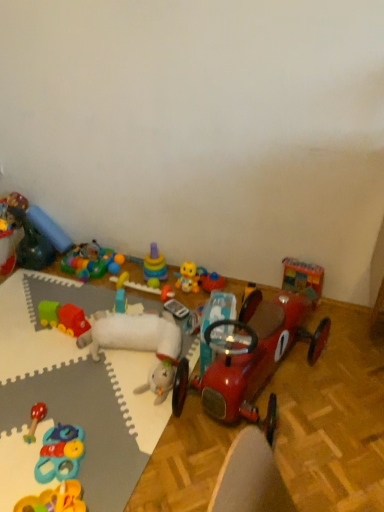
In order to face white plush lamb at lower left, acting as the eighth toy starting from the left, should I rotate leftwards or rightwards?

It's best to rotate left around 7.818 degrees.

Locate an element on the screen. This screenshot has height=512, width=384. white plush lamb at lower left, the fifth toy positioned from the right is located at coordinates (133, 334).

What are the coordinates of `rubber green and red train at lower left, marked as the 4th toy in a left-to-right arrangement` in the screenshot? It's located at (63, 318).

In order to face wooden toy car at upper right, the twelfth toy when ordered from left to right, should I rotate leftwards or rightwards?

Rotate your view right by about 14.452°.

Image resolution: width=384 pixels, height=512 pixels. Find the location of `translucent plastic toy at center, arranged as the 5th toy when viewed from the left`. translucent plastic toy at center, arranged as the 5th toy when viewed from the left is located at coordinates (87, 261).

Is rubberized plastic toy at lower left, placed as the 7th toy when sorted from left to right, smaller than wooden toy car at upper right, the first toy viewed from the right?

Yes, rubberized plastic toy at lower left, placed as the 7th toy when sorted from left to right, is smaller than wooden toy car at upper right, the first toy viewed from the right.

How different are the orientations of rubberized plastic toy at lower left, marked as the sixth toy in a right-to-left arrangement, and wooden toy car at upper right, the twelfth toy when ordered from left to right, in degrees?

There is a 55-degree angle between the facing directions of rubberized plastic toy at lower left, marked as the sixth toy in a right-to-left arrangement, and wooden toy car at upper right, the twelfth toy when ordered from left to right.

Is there a large distance between rubberized plastic toy at lower left, marked as the sixth toy in a right-to-left arrangement, and wooden toy car at upper right, the twelfth toy when ordered from left to right?

Yes, rubberized plastic toy at lower left, marked as the sixth toy in a right-to-left arrangement, and wooden toy car at upper right, the twelfth toy when ordered from left to right, are quite far apart.

Could you tell me if rubberized plastic toy at lower left, marked as the sixth toy in a right-to-left arrangement, is turned towards wooden toy car at upper right, the twelfth toy when ordered from left to right?

No, rubberized plastic toy at lower left, marked as the sixth toy in a right-to-left arrangement, is not turned towards wooden toy car at upper right, the twelfth toy when ordered from left to right.

Which is more to the right, wooden rattle at lower left, the seventh toy viewed from the right, or rubber green and red train at lower left, positioned as the ninth toy in right-to-left order?

wooden rattle at lower left, the seventh toy viewed from the right, is more to the right.

Considering the relative sizes of wooden rattle at lower left, positioned as the 6th toy in left-to-right order, and rubber green and red train at lower left, positioned as the ninth toy in right-to-left order, in the image provided, is wooden rattle at lower left, positioned as the 6th toy in left-to-right order, taller than rubber green and red train at lower left, positioned as the ninth toy in right-to-left order,?

In fact, wooden rattle at lower left, positioned as the 6th toy in left-to-right order, may be shorter than rubber green and red train at lower left, positioned as the ninth toy in right-to-left order.

From a real-world perspective, between wooden rattle at lower left, the seventh toy viewed from the right, and rubber green and red train at lower left, positioned as the ninth toy in right-to-left order, who is vertically lower?

wooden rattle at lower left, the seventh toy viewed from the right, is physically lower.

Would you say wooden rattle at lower left, positioned as the 6th toy in left-to-right order, is a long distance from rubber green and red train at lower left, marked as the 4th toy in a left-to-right arrangement?

No, wooden rattle at lower left, positioned as the 6th toy in left-to-right order, is not far away from rubber green and red train at lower left, marked as the 4th toy in a left-to-right arrangement.

From a real-world perspective, is shiny red car at center, acting as the 2th toy starting from the right, over blue fabric pillow at upper left, positioned as the 3th toy in left-to-right order?

Correct, in the physical world, shiny red car at center, acting as the 2th toy starting from the right, is higher than blue fabric pillow at upper left, positioned as the 3th toy in left-to-right order.

From the image's perspective, which object appears higher, shiny red car at center, acting as the 2th toy starting from the right, or blue fabric pillow at upper left, the tenth toy positioned from the right?

blue fabric pillow at upper left, the tenth toy positioned from the right, from the image's perspective.

Between shiny red car at center, acting as the 2th toy starting from the right, and blue fabric pillow at upper left, positioned as the 3th toy in left-to-right order, which one appears on the right side from the viewer's perspective?

Positioned to the right is shiny red car at center, acting as the 2th toy starting from the right.

Which is behind, shiny red car at center, acting as the 2th toy starting from the right, or blue fabric pillow at upper left, the tenth toy positioned from the right?

blue fabric pillow at upper left, the tenth toy positioned from the right.

In terms of size, does white foam mat at lower left appear bigger or smaller than wooden toy car at upper right, the first toy viewed from the right?

white foam mat at lower left is bigger than wooden toy car at upper right, the first toy viewed from the right.

Is white foam mat at lower left to the left of wooden toy car at upper right, the twelfth toy when ordered from left to right, from the viewer's perspective?

Indeed, white foam mat at lower left is positioned on the left side of wooden toy car at upper right, the twelfth toy when ordered from left to right.

From the image's perspective, is white foam mat at lower left on wooden toy car at upper right, the first toy viewed from the right?

No.

Considering the points (102, 298) and (287, 287), which point is behind, point (102, 298) or point (287, 287)?

Positioned behind is point (102, 298).

I want to click on the 4th toy located beneath the rubber duck at left, the twelfth toy from the right (from a real-world perspective), so point(87,261).

Do you think translucent plastic toy at center, the eighth toy in the right-to-left sequence, is within rubber duck at left, acting as the 1th toy starting from the left, or outside of it?

translucent plastic toy at center, the eighth toy in the right-to-left sequence, cannot be found inside rubber duck at left, acting as the 1th toy starting from the left.

Which is nearer, [99,268] or [0,239]?

Clearly, point [99,268] is closer to the camera than point [0,239].

Considering the points (90, 243) and (37, 463), which point is behind, point (90, 243) or point (37, 463)?

The point (90, 243) is farther from the camera.

Is translucent plastic toy at center, arranged as the 5th toy when viewed from the left, in front of or behind rubberized plastic toy at lower left, placed as the 7th toy when sorted from left to right, in the image?

translucent plastic toy at center, arranged as the 5th toy when viewed from the left, is behind rubberized plastic toy at lower left, placed as the 7th toy when sorted from left to right.

From the image's perspective, does translucent plastic toy at center, arranged as the 5th toy when viewed from the left, appear lower than rubberized plastic toy at lower left, marked as the sixth toy in a right-to-left arrangement?

Incorrect, from the image's perspective, translucent plastic toy at center, arranged as the 5th toy when viewed from the left, is higher than rubberized plastic toy at lower left, marked as the sixth toy in a right-to-left arrangement.

Considering the relative positions of translucent plastic toy at center, the eighth toy in the right-to-left sequence, and rubberized plastic toy at lower left, marked as the sixth toy in a right-to-left arrangement, in the image provided, is translucent plastic toy at center, the eighth toy in the right-to-left sequence, to the left of rubberized plastic toy at lower left, marked as the sixth toy in a right-to-left arrangement, from the viewer's perspective?

Yes.

Can you tell me how much shiny red car at center, marked as the eleventh toy in a left-to-right arrangement, and yellow rubber duck at center, which ranks as the tenth toy in left-to-right order, differ in facing direction?

There is a 11.2-degree angle between the facing directions of shiny red car at center, marked as the eleventh toy in a left-to-right arrangement, and yellow rubber duck at center, which ranks as the tenth toy in left-to-right order.

Is shiny red car at center, acting as the 2th toy starting from the right, outside of yellow rubber duck at center, which is the third toy from right to left?

Yes, shiny red car at center, acting as the 2th toy starting from the right, is located beyond the bounds of yellow rubber duck at center, which is the third toy from right to left.

Is shiny red car at center, marked as the eleventh toy in a left-to-right arrangement, to the left of yellow rubber duck at center, which is the third toy from right to left, from the viewer's perspective?

No, shiny red car at center, marked as the eleventh toy in a left-to-right arrangement, is not to the left of yellow rubber duck at center, which is the third toy from right to left.

Is shiny red car at center, acting as the 2th toy starting from the right, wider or thinner than yellow rubber duck at center, which is the third toy from right to left?

shiny red car at center, acting as the 2th toy starting from the right, is wider than yellow rubber duck at center, which is the third toy from right to left.

From the rubberized plastic toy at lower left, marked as the sixth toy in a right-to-left arrangement, count 5th toy to the right and point to it. Please provide its 2D coordinates.

[(303, 278)]

Where is `toy that is the 3rd one when counting downward from the rubber green and red train at lower left, marked as the 4th toy in a left-to-right arrangement (from the image's perspective)`? This screenshot has width=384, height=512. toy that is the 3rd one when counting downward from the rubber green and red train at lower left, marked as the 4th toy in a left-to-right arrangement (from the image's perspective) is located at coordinates (35, 421).

Based on their spatial positions, is white foam mat at lower left or wooden toy car at upper right, the twelfth toy when ordered from left to right, closer to translucent plastic toy at center, the eighth toy in the right-to-left sequence?

Among the two, white foam mat at lower left is located nearer to translucent plastic toy at center, the eighth toy in the right-to-left sequence.

Based on the photo, based on their spatial positions, is rubber duck at left, the twelfth toy from the right, or blue fabric pillow at upper left, positioned as the 3th toy in left-to-right order, further from rubber duck at upper left, the 11th toy from the right?

The object further to rubber duck at upper left, the 11th toy from the right, is rubber duck at left, the twelfth toy from the right.

Based on their spatial positions, is white plush lamb at lower left, acting as the eighth toy starting from the left, or rubber green and red train at lower left, marked as the 4th toy in a left-to-right arrangement, closer to translucent plastic toy at center, the eighth toy in the right-to-left sequence?

rubber green and red train at lower left, marked as the 4th toy in a left-to-right arrangement, lies closer to translucent plastic toy at center, the eighth toy in the right-to-left sequence, than the other object.

In the scene shown: Estimate the real-world distances between objects in this image. Which object is closer to white foam mat at lower left, white plush lamb at lower left, the fifth toy positioned from the right, or rubber duck at upper left, the 11th toy from the right?

white plush lamb at lower left, the fifth toy positioned from the right, is positioned closer to the anchor white foam mat at lower left.

In the scene shown: Which object lies nearer to the anchor point rubberized plastic toy at lower left, marked as the sixth toy in a right-to-left arrangement, blue fabric pillow at upper left, the tenth toy positioned from the right, or rubber duck at upper left, the second toy when ordered from left to right?

rubber duck at upper left, the second toy when ordered from left to right.

Looking at the image, which one is located closer to rubber duck at upper left, the 11th toy from the right, rubberized plastic toy at lower left, placed as the 7th toy when sorted from left to right, or yellow rubber duck at center, which is the third toy from right to left?

yellow rubber duck at center, which is the third toy from right to left, is positioned closer to the anchor rubber duck at upper left, the 11th toy from the right.

Estimate the real-world distances between objects in this image. Which object is closer to translucent plastic toy at center, arranged as the 5th toy when viewed from the left, white foam mat at lower left or rubber green and red train at lower left, marked as the 4th toy in a left-to-right arrangement?

rubber green and red train at lower left, marked as the 4th toy in a left-to-right arrangement, is positioned closer to the anchor translucent plastic toy at center, arranged as the 5th toy when viewed from the left.

Based on the photo, from the image, which object appears to be farther from wooden rattle at lower left, positioned as the 6th toy in left-to-right order, yellow rubber duck at center, which is the third toy from right to left, or shiny red car at center, marked as the eleventh toy in a left-to-right arrangement?

The object further to wooden rattle at lower left, positioned as the 6th toy in left-to-right order, is yellow rubber duck at center, which is the third toy from right to left.

The height and width of the screenshot is (512, 384). In order to click on table between rubber duck at upper left, the 11th toy from the right, and wooden toy car at upper right, the first toy viewed from the right, from left to right in this screenshot , I will do `click(78, 387)`.

You are a GUI agent. You are given a task and a screenshot of the screen. Output one action in this format:
    pyautogui.click(x=<x>, y=<y>)
    Task: Click on the table between rubber duck at left, the twelfth toy from the right, and wooden toy car at upper right, the twelfth toy when ordered from left to right, in the horizontal direction
    Image resolution: width=384 pixels, height=512 pixels.
    Given the screenshot: What is the action you would take?
    pyautogui.click(x=78, y=387)

Locate an element on the screen. This screenshot has height=512, width=384. table between rubber duck at upper left, the second toy when ordered from left to right, and shiny red car at center, acting as the 2th toy starting from the right is located at coordinates (78, 387).

Identify the location of toy between rubber duck at left, acting as the 1th toy starting from the left, and blue fabric pillow at upper left, positioned as the 3th toy in left-to-right order. (34, 233).